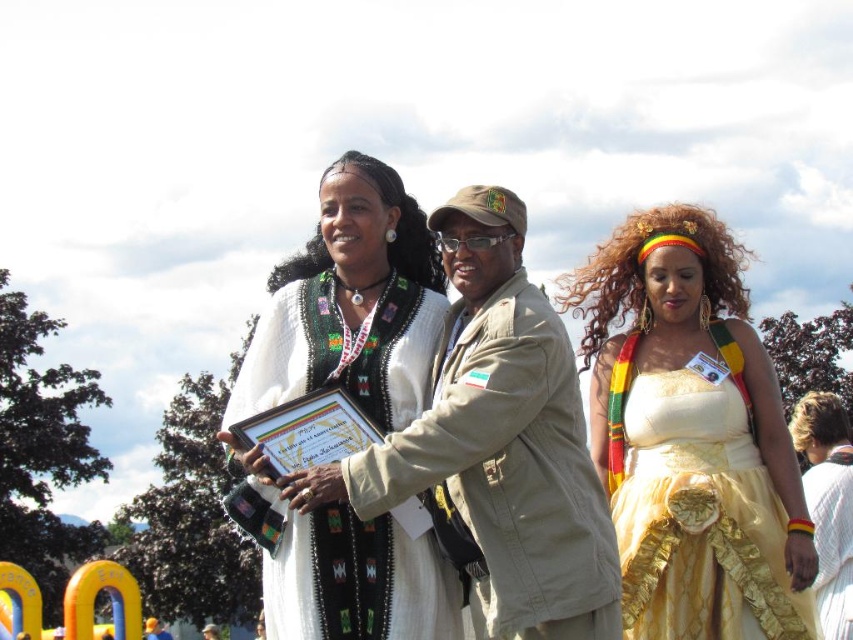
Which is in front, point (437, 413) or point (260, 470)?

Positioned in front is point (437, 413).

Does khaki fabric jacket at center have a lesser height compared to white woven dress at center?

Indeed, khaki fabric jacket at center has a lesser height compared to white woven dress at center.

The height and width of the screenshot is (640, 853). I want to click on khaki fabric jacket at center, so click(x=498, y=440).

In the scene shown: Is khaki fabric jacket at center further to camera compared to yellow satin dress at center?

No.

Between point (457, 381) and point (672, 401), which one is positioned in front?

Positioned in front is point (457, 381).

Identify the location of khaki fabric jacket at center. This screenshot has width=853, height=640. (498, 440).

Between point (572, 435) and point (842, 541), which one is positioned in front?

Point (572, 435) is in front.

Is khaki fabric jacket at center bigger than white fabric at center?

Incorrect, khaki fabric jacket at center is not larger than white fabric at center.

Image resolution: width=853 pixels, height=640 pixels. Describe the element at coordinates (498, 440) in the screenshot. I see `khaki fabric jacket at center` at that location.

Locate an element on the screen. The height and width of the screenshot is (640, 853). khaki fabric jacket at center is located at coordinates (498, 440).